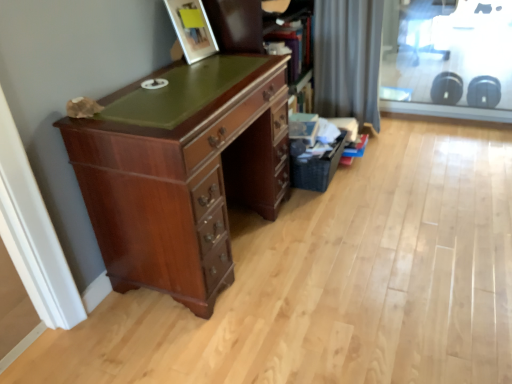
Measure the distance between point (374,7) and camera.

A distance of 2.63 meters exists between point (374,7) and camera.

Identify the location of wooden bookshelf at upper center. This screenshot has height=384, width=512. (294, 39).

This screenshot has width=512, height=384. Describe the element at coordinates (294, 39) in the screenshot. I see `wooden bookshelf at upper center` at that location.

Where is `mahogany wood desk at left`? mahogany wood desk at left is located at coordinates (183, 172).

Consider the image. How different are the orientations of matte wood picture frame at upper center and mahogany wood desk at left in degrees?

The angular difference between matte wood picture frame at upper center and mahogany wood desk at left is 7.92 degrees.

Is matte wood picture frame at upper center aimed at mahogany wood desk at left?

No, matte wood picture frame at upper center is not aimed at mahogany wood desk at left.

Is matte wood picture frame at upper center beside mahogany wood desk at left?

No, matte wood picture frame at upper center is not making contact with mahogany wood desk at left.

Considering the relative sizes of matte wood picture frame at upper center and mahogany wood desk at left in the image provided, is matte wood picture frame at upper center taller than mahogany wood desk at left?

In fact, matte wood picture frame at upper center may be shorter than mahogany wood desk at left.

Is black woven basket at lower right oriented away from matte wood picture frame at upper center?

No, matte wood picture frame at upper center is not at the back of black woven basket at lower right.

How different are the orientations of black woven basket at lower right and matte wood picture frame at upper center in degrees?

They differ by 9.55 degrees in their facing directions.

Does black woven basket at lower right appear on the left side of matte wood picture frame at upper center?

Incorrect, black woven basket at lower right is not on the left side of matte wood picture frame at upper center.

In the scene shown: From a real-world perspective, is transparent glass screen door at upper right positioned over gray fabric curtain at upper right based on gravity?

Incorrect, from a real-world perspective, transparent glass screen door at upper right is lower than gray fabric curtain at upper right.

Does transparent glass screen door at upper right have a greater width compared to gray fabric curtain at upper right?

No, transparent glass screen door at upper right is not wider than gray fabric curtain at upper right.

Which of these two, transparent glass screen door at upper right or gray fabric curtain at upper right, stands taller?

With more height is gray fabric curtain at upper right.

From the picture: Which point is more distant from viewer, (440, 100) or (370, 67)?

The point (440, 100) is farther.

Can you confirm if black woven basket at lower right is taller than mahogany wood desk at left?

No.

Which object is wider, black woven basket at lower right or mahogany wood desk at left?

mahogany wood desk at left.

Consider the image. From a real-world perspective, is black woven basket at lower right above or below mahogany wood desk at left?

In terms of real-world spatial position, black woven basket at lower right is below mahogany wood desk at left.

This screenshot has height=384, width=512. There is a black woven basket at lower right. What are the coordinates of `the chest of drawers above it (from a real-world perspective)` in the screenshot? It's located at (183, 172).

From the image's perspective, is transparent glass screen door at upper right positioned above or below mahogany wood desk at left?

transparent glass screen door at upper right is situated higher than mahogany wood desk at left in the image.

In the scene shown: Which object is positioned more to the left, transparent glass screen door at upper right or mahogany wood desk at left?

mahogany wood desk at left is more to the left.

Considering the sizes of objects transparent glass screen door at upper right and mahogany wood desk at left in the image provided, who is thinner, transparent glass screen door at upper right or mahogany wood desk at left?

transparent glass screen door at upper right.

From a real-world perspective, which is physically below, transparent glass screen door at upper right or matte wood picture frame at upper center?

From a 3D spatial view, transparent glass screen door at upper right is below.

I want to click on picture frame in front of the transparent glass screen door at upper right, so click(x=192, y=29).

In the scene shown: Which is more to the left, transparent glass screen door at upper right or matte wood picture frame at upper center?

matte wood picture frame at upper center.

Which object is further away from the camera, wooden bookshelf at upper center or black woven basket at lower right?

Positioned behind is black woven basket at lower right.

Could you tell me if wooden bookshelf at upper center is turned towards black woven basket at lower right?

No.

Locate an element on the screen. The image size is (512, 384). bookshelf on the left of black woven basket at lower right is located at coordinates (294, 39).

Identify the location of the chest of drawers beneath the matte wood picture frame at upper center (from a real-world perspective). (183, 172).

Find the location of a particular element. picture frame lying on the left of black woven basket at lower right is located at coordinates (192, 29).

Looking at the image, which one is located closer to transparent glass screen door at upper right, mahogany wood desk at left or black woven basket at lower right?

black woven basket at lower right.

Looking at this image, from the image, which object appears to be farther from transparent glass screen door at upper right, wooden bookshelf at upper center or black woven basket at lower right?

black woven basket at lower right lies further to transparent glass screen door at upper right than the other object.

From the image, which object appears to be nearer to mahogany wood desk at left, wooden bookshelf at upper center or transparent glass screen door at upper right?

wooden bookshelf at upper center is positioned closer to the anchor mahogany wood desk at left.

Based on their spatial positions, is transparent glass screen door at upper right or matte wood picture frame at upper center further from mahogany wood desk at left?

transparent glass screen door at upper right lies further to mahogany wood desk at left than the other object.

Which object lies further to the anchor point gray fabric curtain at upper right, wooden bookshelf at upper center or black woven basket at lower right?

The object further to gray fabric curtain at upper right is black woven basket at lower right.

Based on their spatial positions, is black woven basket at lower right or transparent glass screen door at upper right further from mahogany wood desk at left?

transparent glass screen door at upper right lies further to mahogany wood desk at left than the other object.

Looking at the image, which one is located further to transparent glass screen door at upper right, wooden bookshelf at upper center or mahogany wood desk at left?

Based on the image, mahogany wood desk at left appears to be further to transparent glass screen door at upper right.

When comparing their distances from black woven basket at lower right, does matte wood picture frame at upper center or wooden bookshelf at upper center seem further?

Based on the image, matte wood picture frame at upper center appears to be further to black woven basket at lower right.

Identify the location of basket located between matte wood picture frame at upper center and transparent glass screen door at upper right in the left-right direction. (317, 168).

At what (x,y) coordinates should I click in order to perform the action: click on basket between mahogany wood desk at left and transparent glass screen door at upper right in the horizontal direction. Please return your answer as a coordinate pair (x, y). This screenshot has width=512, height=384. Looking at the image, I should click on (317, 168).

Identify the location of bookshelf between gray fabric curtain at upper right and black woven basket at lower right vertically. The width and height of the screenshot is (512, 384). pos(294,39).

Identify the location of picture frame between mahogany wood desk at left and gray fabric curtain at upper right in the front-back direction. The width and height of the screenshot is (512, 384). (192, 29).